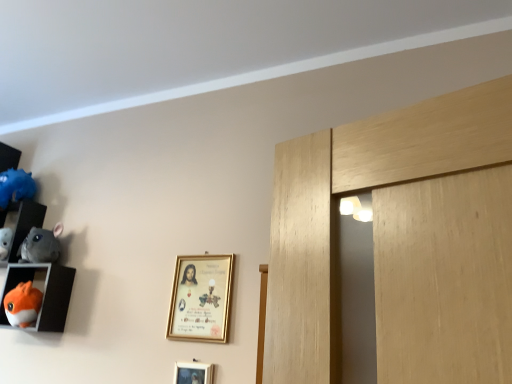
Question: Does gray plush chinchilla at left, which ranks as the 2th toy in top-to-bottom order, have a lesser width compared to matte plastic shelf at left, the 2th shelf in the bottom-to-top sequence?

Choices:
 (A) yes
 (B) no

Answer: (A)

Question: Is matte plastic shelf at left, which ranks as the 1th shelf in top-to-bottom order, completely or partially inside gray plush chinchilla at left, the 2th toy from the bottom?

Choices:
 (A) no
 (B) yes

Answer: (A)

Question: Is gray plush chinchilla at left, which ranks as the 2th toy in top-to-bottom order, further to the viewer compared to matte plastic shelf at left, which ranks as the 1th shelf in top-to-bottom order?

Choices:
 (A) yes
 (B) no

Answer: (B)

Question: Would you say gray plush chinchilla at left, which ranks as the 2th toy in top-to-bottom order, is outside matte plastic shelf at left, the 2th shelf in the bottom-to-top sequence?

Choices:
 (A) yes
 (B) no

Answer: (A)

Question: Is gray plush chinchilla at left, the 2th toy from the bottom, to the left of matte plastic shelf at left, which ranks as the 1th shelf in top-to-bottom order, from the viewer's perspective?

Choices:
 (A) yes
 (B) no

Answer: (B)

Question: Is orange plush toy at left, the 2th shelf positioned from the top, inside or outside of matte plastic shelf at left, which ranks as the 1th shelf in top-to-bottom order?

Choices:
 (A) inside
 (B) outside

Answer: (B)

Question: From their relative heights in the image, would you say orange plush toy at left, positioned as the first shelf in bottom-to-top order, is taller or shorter than matte plastic shelf at left, the 2th shelf in the bottom-to-top sequence?

Choices:
 (A) short
 (B) tall

Answer: (A)

Question: Based on their positions, is orange plush toy at left, the 2th shelf positioned from the top, located to the left or right of matte plastic shelf at left, which ranks as the 1th shelf in top-to-bottom order?

Choices:
 (A) left
 (B) right

Answer: (B)

Question: In terms of size, does orange plush toy at left, positioned as the first shelf in bottom-to-top order, appear bigger or smaller than matte plastic shelf at left, which ranks as the 1th shelf in top-to-bottom order?

Choices:
 (A) big
 (B) small

Answer: (A)

Question: Is gold metallic picture frame at center, which is counted as the first picture frame, starting from the top, bigger or smaller than gold metallic picture frame at lower center, placed as the first picture frame when sorted from bottom to top?

Choices:
 (A) small
 (B) big

Answer: (B)

Question: In the image, is gold metallic picture frame at center, acting as the second picture frame starting from the bottom, positioned in front of or behind gold metallic picture frame at lower center, placed as the first picture frame when sorted from bottom to top?

Choices:
 (A) front
 (B) behind

Answer: (B)

Question: Considering the positions of gold metallic picture frame at center, acting as the second picture frame starting from the bottom, and gold metallic picture frame at lower center, the second picture frame viewed from the top, in the image, is gold metallic picture frame at center, acting as the second picture frame starting from the bottom, taller or shorter than gold metallic picture frame at lower center, the second picture frame viewed from the top,?

Choices:
 (A) tall
 (B) short

Answer: (A)

Question: In terms of width, does gold metallic picture frame at center, which is counted as the first picture frame, starting from the top, look wider or thinner when compared to gold metallic picture frame at lower center, the second picture frame viewed from the top?

Choices:
 (A) wide
 (B) thin

Answer: (A)

Question: From the image's perspective, is gold metallic picture frame at center, which is counted as the first picture frame, starting from the top, located above or below blue fluffy toy at left, which is the 1th toy in top-to-bottom order?

Choices:
 (A) below
 (B) above

Answer: (A)

Question: Considering the positions of gold metallic picture frame at center, acting as the second picture frame starting from the bottom, and blue fluffy toy at left, which appears as the 3th toy when ordered from the bottom, in the image, is gold metallic picture frame at center, acting as the second picture frame starting from the bottom, wider or thinner than blue fluffy toy at left, which appears as the 3th toy when ordered from the bottom,?

Choices:
 (A) thin
 (B) wide

Answer: (A)